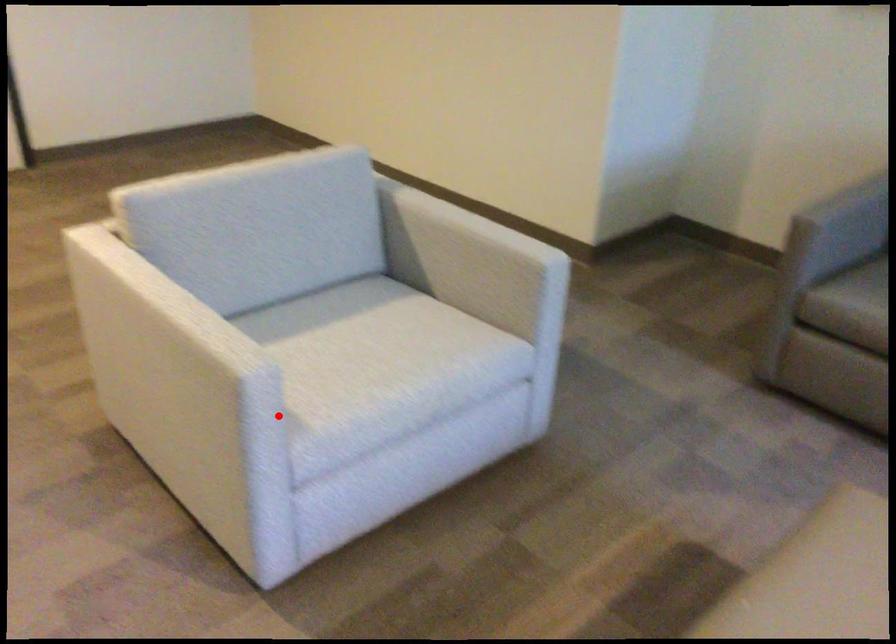
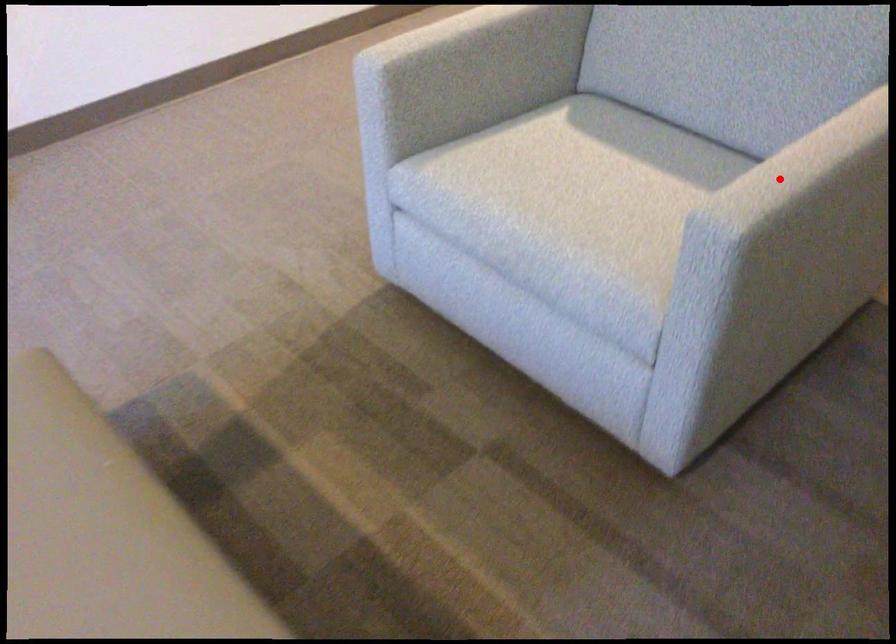
I am providing you with two images of the same scene from different viewpoints. A red point is marked on the first image and another point is marked on the second image. Does the point marked in image1 correspond to the same location as the one in image2?

No